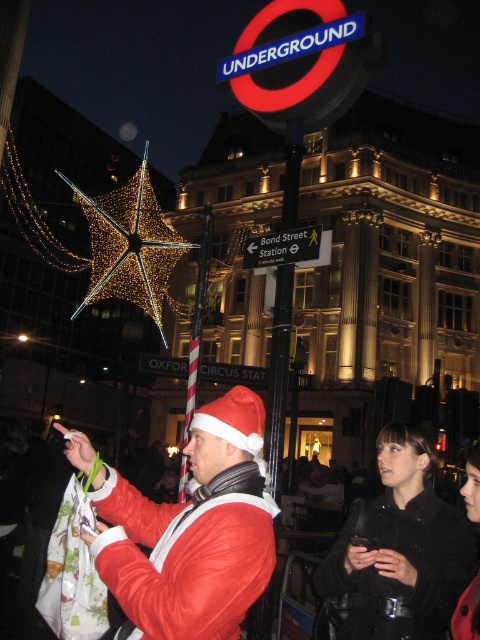
Can you confirm if matte red santa hat at center is positioned above black plastic sign at center?

Incorrect, matte red santa hat at center is not positioned above black plastic sign at center.

Does matte red santa hat at center appear on the left side of black plastic sign at center?

Indeed, matte red santa hat at center is positioned on the left side of black plastic sign at center.

Describe the element at coordinates (192, 531) in the screenshot. The width and height of the screenshot is (480, 640). I see `matte red santa hat at center` at that location.

Image resolution: width=480 pixels, height=640 pixels. In order to click on matte red santa hat at center in this screenshot , I will do `click(192, 531)`.